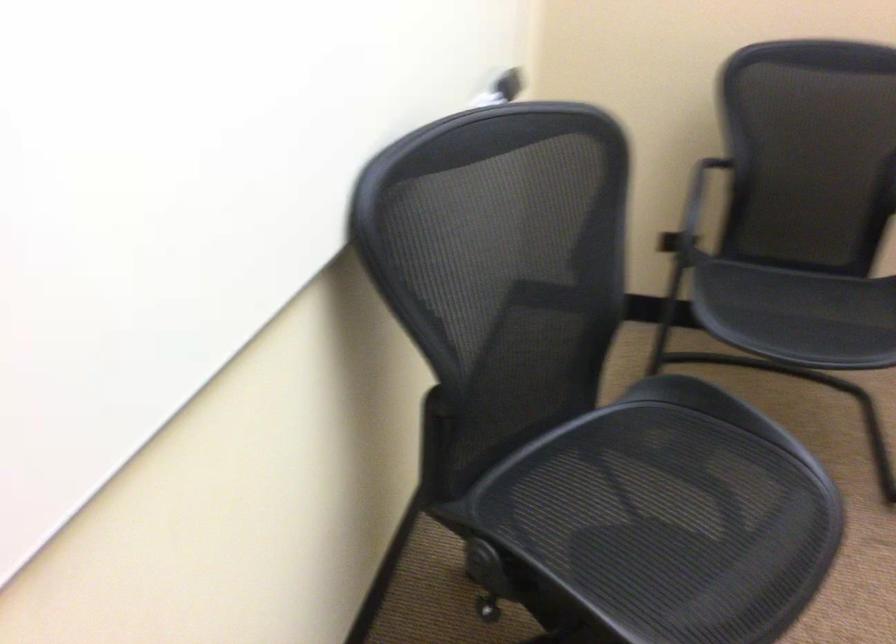
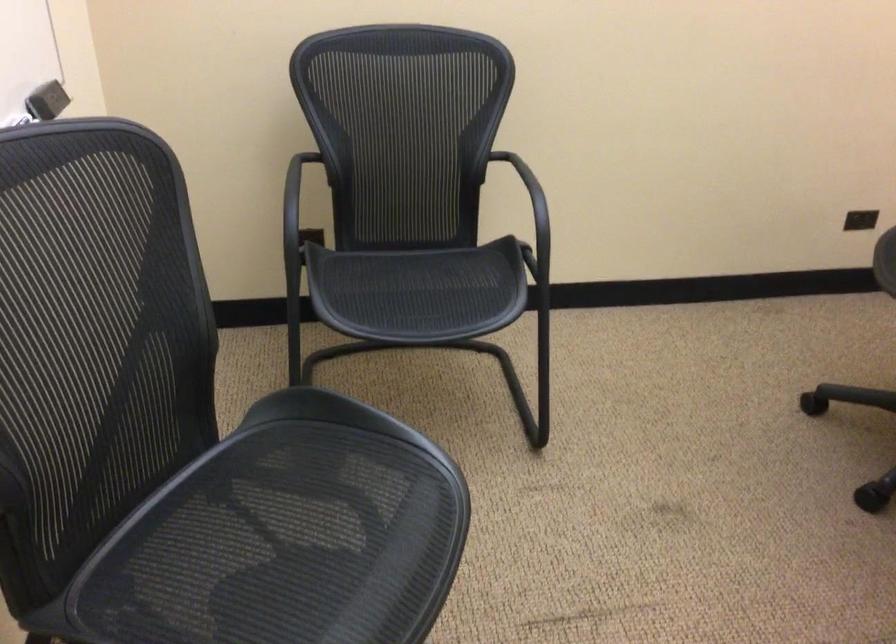
Question: What movement of the cameraman would produce the second image?

Choices:
 (A) Left
 (B) Right
 (C) Forward
 (D) Backward

Answer: (B)